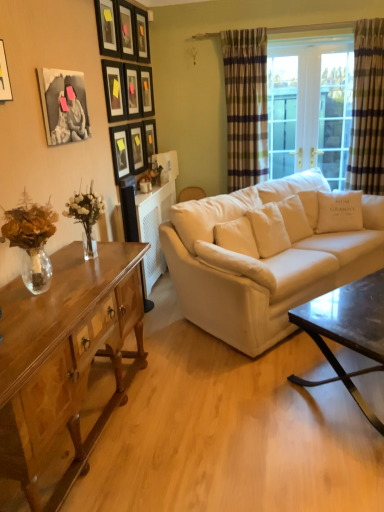
Question: Is wooden picture frame at upper left, which is the 5th picture frame from front to back, positioned behind black matte picture frame at upper left, positioned as the 1th picture frame in front-to-back order?

Choices:
 (A) no
 (B) yes

Answer: (B)

Question: Is wooden picture frame at upper left, the 6th picture frame in the back-to-front sequence, surrounding black matte picture frame at upper left, the tenth picture frame when ordered from back to front?

Choices:
 (A) yes
 (B) no

Answer: (B)

Question: Is wooden picture frame at upper left, the 6th picture frame in the back-to-front sequence, positioned far away from black matte picture frame at upper left, the tenth picture frame when ordered from back to front?

Choices:
 (A) no
 (B) yes

Answer: (B)

Question: Is wooden picture frame at upper left, the 6th picture frame in the back-to-front sequence, bigger than black matte picture frame at upper left, the tenth picture frame when ordered from back to front?

Choices:
 (A) yes
 (B) no

Answer: (B)

Question: Can you confirm if wooden picture frame at upper left, the 6th picture frame in the back-to-front sequence, is thinner than black matte picture frame at upper left, the tenth picture frame when ordered from back to front?

Choices:
 (A) yes
 (B) no

Answer: (B)

Question: Is point (137, 11) closer or farther from the camera than point (317, 289)?

Choices:
 (A) farther
 (B) closer

Answer: (A)

Question: From the image's perspective, relative to white fabric couch at center, is matte black picture frame at upper center, which is counted as the eighth picture frame, starting from the front, above or below?

Choices:
 (A) above
 (B) below

Answer: (A)

Question: Would you say matte black picture frame at upper center, which is counted as the eighth picture frame, starting from the front, is to the left or to the right of white fabric couch at center in the picture?

Choices:
 (A) right
 (B) left

Answer: (B)

Question: Is matte black picture frame at upper center, which is counted as the eighth picture frame, starting from the front, wider or thinner than white fabric couch at center?

Choices:
 (A) thin
 (B) wide

Answer: (A)

Question: From the image's perspective, relative to white fabric pillow at center, arranged as the first pillow when viewed from the left, is matte black picture frame at upper center, which is counted as the second picture frame, starting from the back, above or below?

Choices:
 (A) below
 (B) above

Answer: (B)

Question: Considering their positions, is matte black picture frame at upper center, which appears as the ninth picture frame when viewed from the front, located in front of or behind white fabric pillow at center, which appears as the 2th pillow when viewed from the right?

Choices:
 (A) behind
 (B) front

Answer: (A)

Question: Is matte black picture frame at upper center, which is counted as the second picture frame, starting from the back, spatially inside white fabric pillow at center, arranged as the first pillow when viewed from the left, or outside of it?

Choices:
 (A) outside
 (B) inside

Answer: (A)

Question: Would you say matte black picture frame at upper center, which appears as the ninth picture frame when viewed from the front, is to the left or to the right of white fabric pillow at center, positioned as the second pillow in top-to-bottom order, in the picture?

Choices:
 (A) left
 (B) right

Answer: (A)

Question: In terms of size, does matte black picture frame at center, the 1th picture frame positioned from the back, appear bigger or smaller than black matte picture frame at upper left, the tenth picture frame when ordered from back to front?

Choices:
 (A) big
 (B) small

Answer: (B)

Question: Would you say matte black picture frame at center, which is the tenth picture frame in front-to-back order, is inside or outside black matte picture frame at upper left, positioned as the 1th picture frame in front-to-back order?

Choices:
 (A) inside
 (B) outside

Answer: (B)